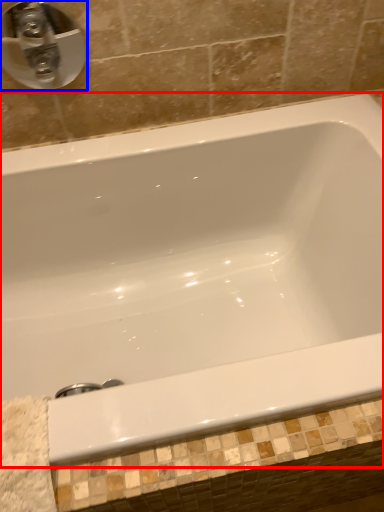
Question: Which point is closer to the camera, bathtub (highlighted by a red box) or tap (highlighted by a blue box)?

Choices:
 (A) bathtub
 (B) tap

Answer: (A)